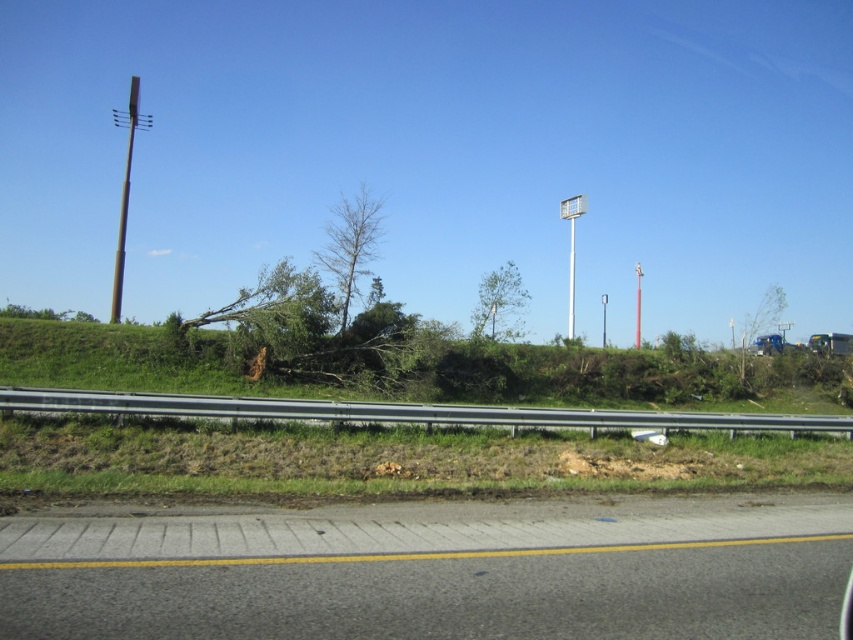
You are a delivery truck driver who needs to make a U turn on the road. The truck requires a minimum turning radius of 18 meters. Given the distance between the silver metallic guardrail at center and the green leafy tree at center, can you safely perform the U turn without hitting either object?

The distance between the silver metallic guardrail at center and the green leafy tree at center is 16.01 meters. Since the required minimum turning radius is 18 meters, which is greater than the available space, the U turn cannot be safely performed without risking collision with either object.

You are standing at point (350, 244) in the scene. What object is located exactly at this coordinate?

The point (350, 244) is occupied by a bare wood tree at center.